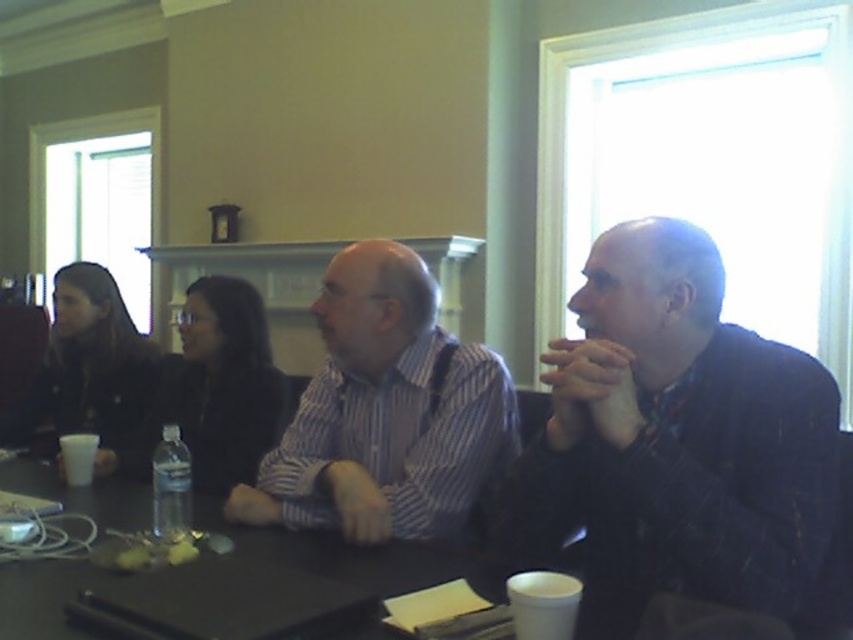
You are standing at the center of the rectangular table in the conference room. You notice two points marked on the floor. The first point is at coordinate point (675,380) and the second point is at coordinate point (387,401). If you were to walk towards both points, which point would you reach first?

Point (675,380) is in front of point (387,401), so you would reach point (675,380) first.

You are organizing a meeting in the conference room and need to place a name tag for the person wearing the dark textured jacket at right. Where should you place it relative to the clear plastic bottle at table center?

The dark textured jacket at right is to the right of the clear plastic bottle at table center, so the name tag should be placed to the right of the clear plastic bottle at table center.

You are a photographer setting up for a group photo. You need to ensure that the dark textured jacket at right and the striped cotton shirt at center are both visible in the frame. Based on their positions, which one should you position closer to the center of the image to avoid obstruction?

The striped cotton shirt at center is already positioned closer to the center of the image. Since the dark textured jacket at right is to the right of the striped cotton shirt at center, positioning the striped cotton shirt at center towards the center ensures it remains visible, while the dark textured jacket at right might need adjustment if it risks being cut off or obscured.